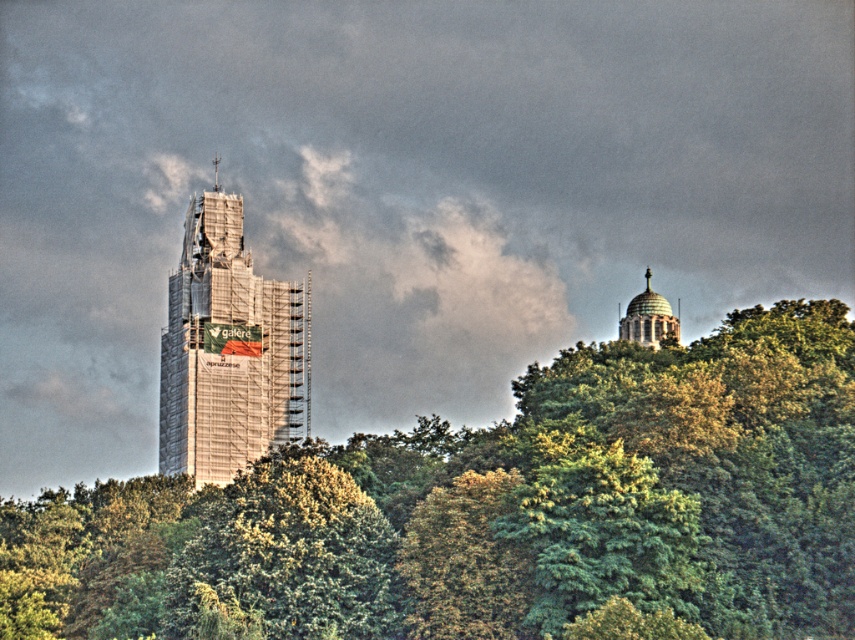
You are a photographer standing at the base of the scaffolding metal tower at center. You want to take a photo of the dome building on the hill with your camera. The camera requires you to be at least 200 meters away from the subject to capture the entire structure in one frame. Can you achieve this by standing at your current position?

The scaffolding metal tower at center and camera are 241.08 meters apart. Since the required distance is at least 200 meters, you can capture the entire dome building on the hill in one frame from your current position.

You are an architect evaluating the image. You need to determine which object occupies more visual space in the composition. Based on the scene, which one is bigger between the scaffolding metal tower at center and the green domed structure at upper right?

The scaffolding metal tower at center is larger in size compared to the green domed structure at upper right, so it occupies more visual space in the composition.

You are a drone operator who needs to fly a drone between the green leafy tree at center and the scaffolding metal tower at center. The drone has a maximum flight distance of 100 meters. Can the drone safely complete the flight between them without exceeding its range?

The green leafy tree at center is 95.91 meters from the scaffolding metal tower at center. Since the drone has a maximum flight distance of 100 meters, it can safely complete the flight between them without exceeding its range.